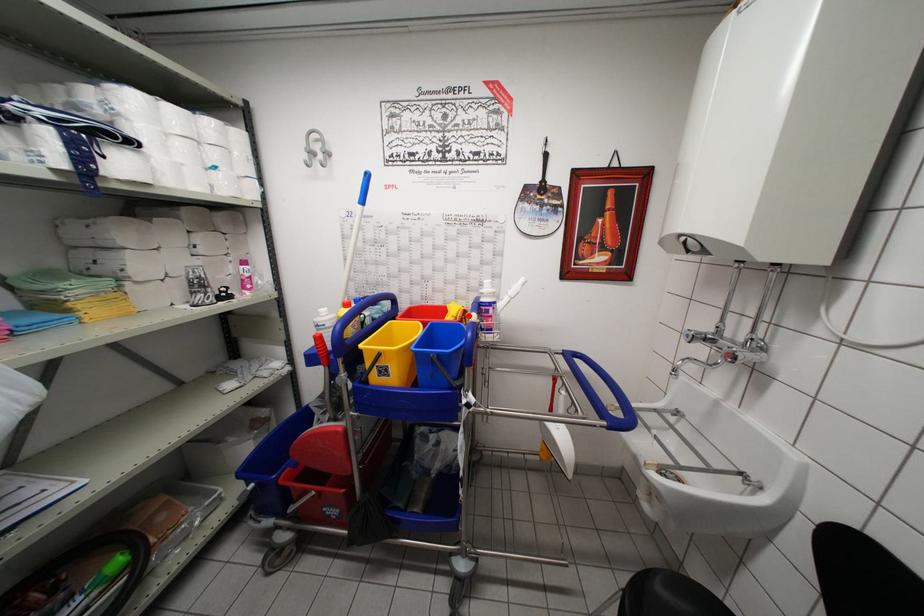
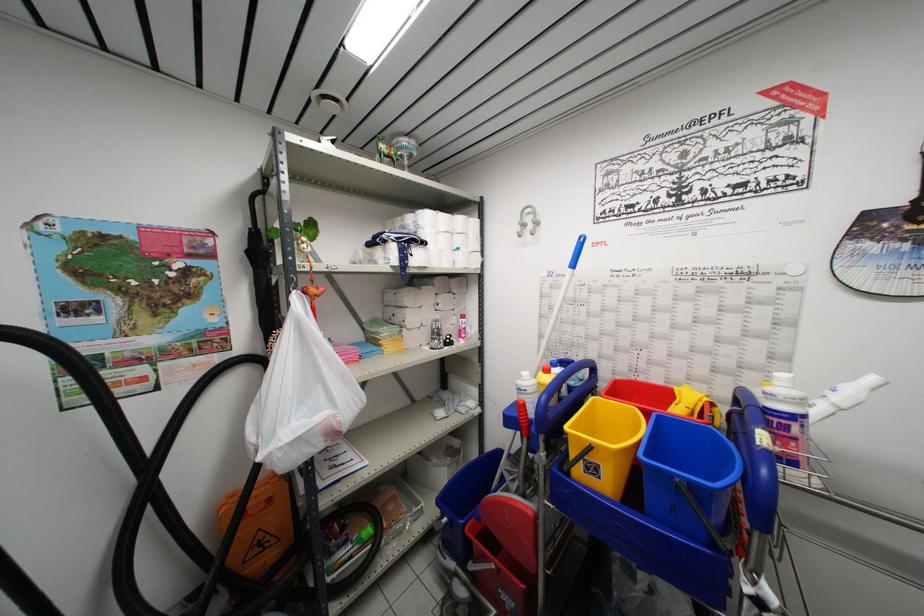
Locate, in the second image, the point that corresponds to the highlighted location in the first image.

(715, 408)